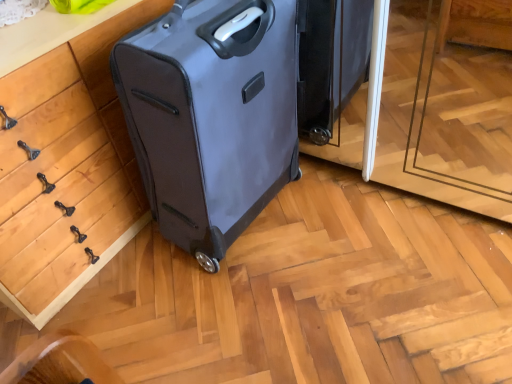
What do you see at coordinates (211, 116) in the screenshot?
I see `matte black suitcase at center` at bounding box center [211, 116].

At what (x,y) coordinates should I click in order to perform the action: click on matte black suitcase at center. Please return your answer as a coordinate pair (x, y). This screenshot has width=512, height=384. Looking at the image, I should click on 211,116.

This screenshot has height=384, width=512. What do you see at coordinates (60, 187) in the screenshot?
I see `wooden drawer at left` at bounding box center [60, 187].

Where is `wooden drawer at left`? The image size is (512, 384). wooden drawer at left is located at coordinates (60, 187).

Identify the location of matte black suitcase at center. (x=211, y=116).

In the scene shown: Can you confirm if matte black suitcase at center is positioned to the right of wooden drawer at left?

Correct, you'll find matte black suitcase at center to the right of wooden drawer at left.

Considering their positions, is matte black suitcase at center located in front of or behind wooden drawer at left?

matte black suitcase at center is positioned farther from the viewer than wooden drawer at left.

Does point (245, 203) come farther from viewer compared to point (127, 147)?

No, it is not.

From the image's perspective, does matte black suitcase at center appear higher than wooden drawer at left?

Correct, matte black suitcase at center appears higher than wooden drawer at left in the image.

From a real-world perspective, relative to wooden drawer at left, is matte black suitcase at center vertically above or below?

From a real-world perspective, matte black suitcase at center is physically above wooden drawer at left.

Is matte black suitcase at center thinner than wooden drawer at left?

Correct, the width of matte black suitcase at center is less than that of wooden drawer at left.

Considering the relative sizes of matte black suitcase at center and wooden drawer at left in the image provided, is matte black suitcase at center taller than wooden drawer at left?

Correct, matte black suitcase at center is much taller as wooden drawer at left.

Between matte black suitcase at center and wooden drawer at left, which one has larger size?

With larger size is wooden drawer at left.

Is wooden drawer at left completely or partially inside matte black suitcase at center?

No.

Are matte black suitcase at center and wooden drawer at left located far from each other?

No, there isn't a large distance between matte black suitcase at center and wooden drawer at left.

Is matte black suitcase at center looking in the opposite direction of wooden drawer at left?

Yes.

The height and width of the screenshot is (384, 512). I want to click on suitcase behind the wooden drawer at left, so click(x=211, y=116).

Does wooden drawer at left appear on the left side of matte black suitcase at center?

Yes.

In the scene shown: Is wooden drawer at left positioned behind matte black suitcase at center?

No, it is not.

Is point (33, 66) closer or farther from the camera than point (265, 169)?

Clearly, point (33, 66) is closer to the camera than point (265, 169).

From the image's perspective, is wooden drawer at left located above or below matte black suitcase at center?

wooden drawer at left is situated lower than matte black suitcase at center in the image.

From a real-world perspective, relative to matte black suitcase at center, is wooden drawer at left vertically above or below?

From a real-world perspective, wooden drawer at left is physically below matte black suitcase at center.

Considering the sizes of objects wooden drawer at left and matte black suitcase at center in the image provided, who is wider, wooden drawer at left or matte black suitcase at center?

With larger width is wooden drawer at left.

From their relative heights in the image, would you say wooden drawer at left is taller or shorter than matte black suitcase at center?

wooden drawer at left is shorter than matte black suitcase at center.

Considering the sizes of objects wooden drawer at left and matte black suitcase at center in the image provided, who is bigger, wooden drawer at left or matte black suitcase at center?

With larger size is wooden drawer at left.

Is wooden drawer at left not within matte black suitcase at center?

Yes.

Looking at this image, are wooden drawer at left and matte black suitcase at center beside each other?

No, wooden drawer at left is not beside matte black suitcase at center.

Is wooden drawer at left oriented towards matte black suitcase at center?

Yes, wooden drawer at left is facing matte black suitcase at center.

How different are the orientations of wooden drawer at left and matte black suitcase at center in degrees?

There is a 2.71-degree angle between the facing directions of wooden drawer at left and matte black suitcase at center.

Looking at this image, how distant is wooden drawer at left from matte black suitcase at center?

wooden drawer at left and matte black suitcase at center are 10.41 inches apart.

Identify the location of suitcase above the wooden drawer at left (from a real-world perspective). The width and height of the screenshot is (512, 384). pos(211,116).

I want to click on drawer that is in front of the matte black suitcase at center, so click(x=60, y=187).

Locate an element on the screen. The height and width of the screenshot is (384, 512). drawer lying below the matte black suitcase at center (from the image's perspective) is located at coordinates (60, 187).